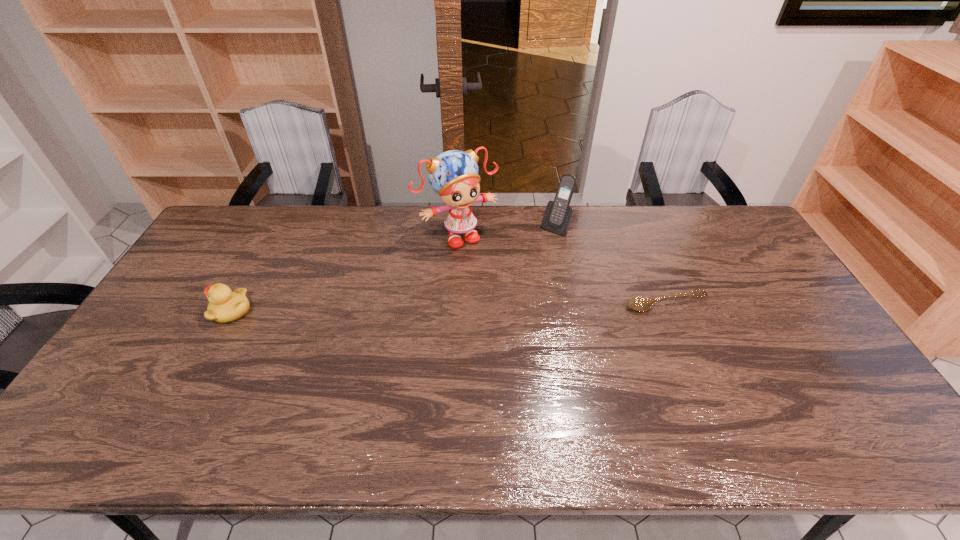
At what (x,y) coordinates should I click in order to perform the action: click on free space located 0.210m on the face of the tallest object. Please return your answer as a coordinate pair (x, y). The width and height of the screenshot is (960, 540). Looking at the image, I should click on (501, 290).

Locate an element on the screen. This screenshot has width=960, height=540. free space located 0.160m on the face of the tallest object is located at coordinates (494, 280).

Find the location of a particular element. The image size is (960, 540). blank area located on the face of the tallest object is located at coordinates (509, 301).

The image size is (960, 540). Find the location of `vacant region located 0.250m on the front-facing side of the third object from left to right`. vacant region located 0.250m on the front-facing side of the third object from left to right is located at coordinates (516, 276).

The height and width of the screenshot is (540, 960). Find the location of `blank area located 0.090m on the front-facing side of the third object from left to right`. blank area located 0.090m on the front-facing side of the third object from left to right is located at coordinates coord(538,249).

Find the location of a particular element. blank area located 0.160m on the front-facing side of the third object from left to right is located at coordinates (528, 260).

The width and height of the screenshot is (960, 540). I want to click on doll situated at the far edge, so point(453,175).

The image size is (960, 540). I want to click on cellular telephone that is at the far edge, so click(x=558, y=214).

This screenshot has width=960, height=540. Find the location of `object that is at the left edge`. object that is at the left edge is located at coordinates (224, 306).

I want to click on free space at the far edge, so click(426, 218).